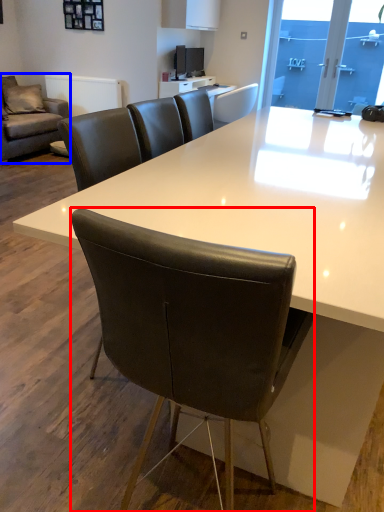
Question: Which object appears farthest to the camera in this image, chair (highlighted by a red box) or studio couch (highlighted by a blue box)?

Choices:
 (A) chair
 (B) studio couch

Answer: (B)